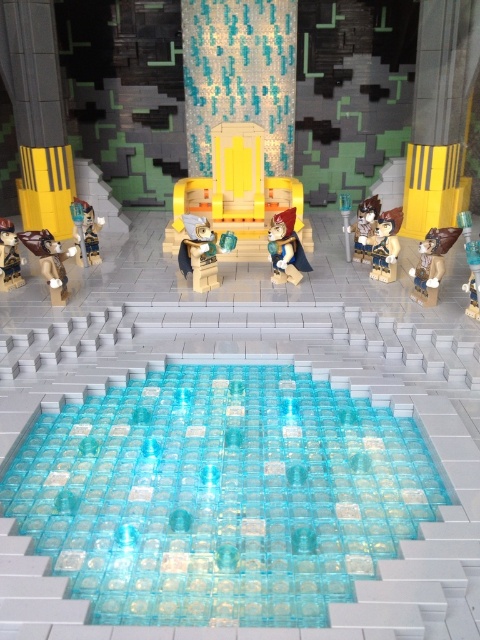
Which is below, translucent blue tiles at center or translucent plastic sword at center?

translucent blue tiles at center is lower down.

Is translucent blue tiles at center bigger than translucent plastic sword at center?

Yes.

At what (x,y) coordinates should I click in order to perform the action: click on translucent blue tiles at center. Please return your answer as a coordinate pair (x, y). The image size is (480, 640). Looking at the image, I should click on (219, 493).

Can you confirm if matte brown minifigure at lower left is taller than translucent plastic sword at left?

Yes, matte brown minifigure at lower left is taller than translucent plastic sword at left.

Is matte brown minifigure at lower left further to camera compared to translucent plastic sword at left?

No, it is not.

Between point (19, 282) and point (90, 243), which one is positioned in front?

Positioned in front is point (19, 282).

Find the location of a particular element. The image size is (480, 640). matte brown minifigure at lower left is located at coordinates (9, 257).

Is point (203, 189) more distant than point (381, 232)?

Yes, point (203, 189) is behind point (381, 232).

In the scene shown: How far apart are yellow plastic chair at center and brown matte minifigure at center-right?

4.27 feet

Who is more distant from viewer, (253, 259) or (372, 260)?

The point (253, 259) is more distant.

This screenshot has width=480, height=640. Identify the location of yellow plastic chair at center. (238, 193).